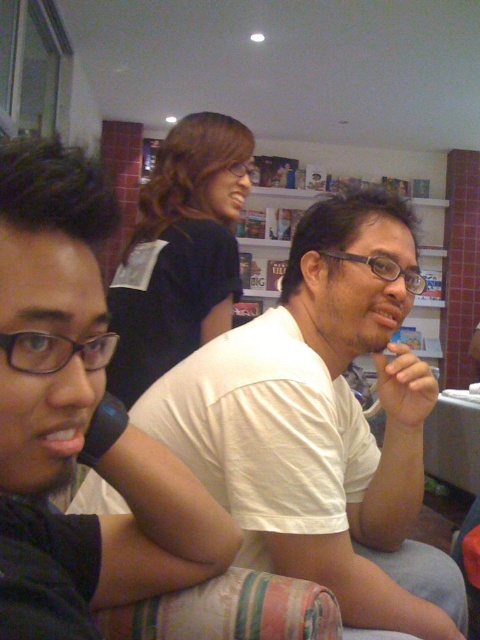
Question: Where is white matte shirt at center located in relation to white matte t-shirt at center in the image?

Choices:
 (A) above
 (B) below

Answer: (B)

Question: Is white matte shirt at center bigger than pink matte lips at center?

Choices:
 (A) no
 (B) yes

Answer: (B)

Question: Does black matte shirt at upper center appear under white glossy bookshelf at upper center?

Choices:
 (A) no
 (B) yes

Answer: (B)

Question: Among these objects, which one is farthest from the camera?

Choices:
 (A) black matte shirt at upper center
 (B) white glossy bookshelf at upper center

Answer: (B)

Question: Considering the real-world distances, which object is farthest from the white glossy bookshelf at upper center?

Choices:
 (A) white matte shirt at center
 (B) pink matte lips at center
 (C) white matte t-shirt at center

Answer: (B)

Question: Which point is closer to the camera taking this photo?

Choices:
 (A) (219, 486)
 (B) (78, 426)
 (C) (429, 260)

Answer: (B)